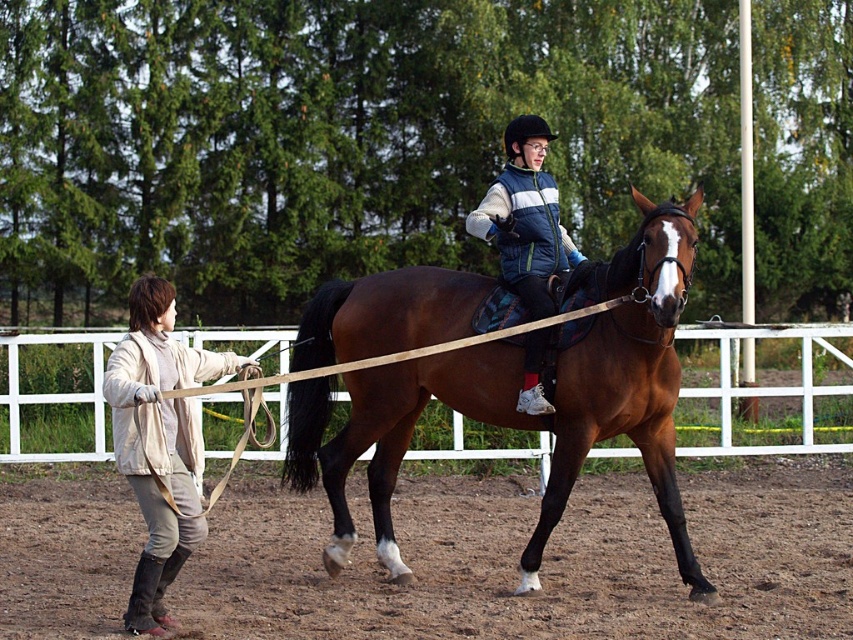
Can you confirm if light beige fabric jacket at left is shorter than blue padded vest at center?

Yes, light beige fabric jacket at left is shorter than blue padded vest at center.

Describe the element at coordinates (160, 442) in the screenshot. This screenshot has height=640, width=853. I see `light beige fabric jacket at left` at that location.

Find the location of a particular element. light beige fabric jacket at left is located at coordinates (160, 442).

In the scene shown: Is brown dirt track at center further to the viewer compared to blue padded vest at center?

No, it is not.

Can you confirm if brown dirt track at center is smaller than blue padded vest at center?

Indeed, brown dirt track at center has a smaller size compared to blue padded vest at center.

Image resolution: width=853 pixels, height=640 pixels. Describe the element at coordinates (541, 564) in the screenshot. I see `brown dirt track at center` at that location.

Find the location of a particular element. brown dirt track at center is located at coordinates (541, 564).

Between brown dirt track at center and light beige fabric jacket at left, which one is positioned lower?

brown dirt track at center is lower down.

Can you confirm if brown dirt track at center is smaller than light beige fabric jacket at left?

Incorrect, brown dirt track at center is not smaller in size than light beige fabric jacket at left.

Between point (635, 621) and point (134, 289), which one is positioned in front?

Point (134, 289)

Identify the location of brown dirt track at center. (541, 564).